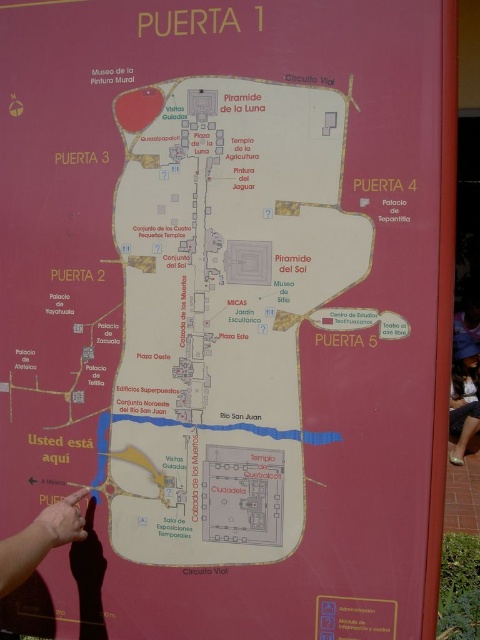
Question: Can you confirm if white paper map at center is positioned above matte black dress at lower right?

Choices:
 (A) yes
 (B) no

Answer: (A)

Question: Does white paper map at center come behind matte black dress at lower right?

Choices:
 (A) yes
 (B) no

Answer: (B)

Question: Which of the following is the farthest from the observer?

Choices:
 (A) white paper map at center
 (B) matte black dress at lower right

Answer: (B)

Question: Is white paper map at center thinner than matte black dress at lower right?

Choices:
 (A) yes
 (B) no

Answer: (B)

Question: Among these objects, which one is farthest from the camera?

Choices:
 (A) matte black dress at lower right
 (B) white paper map at center

Answer: (A)